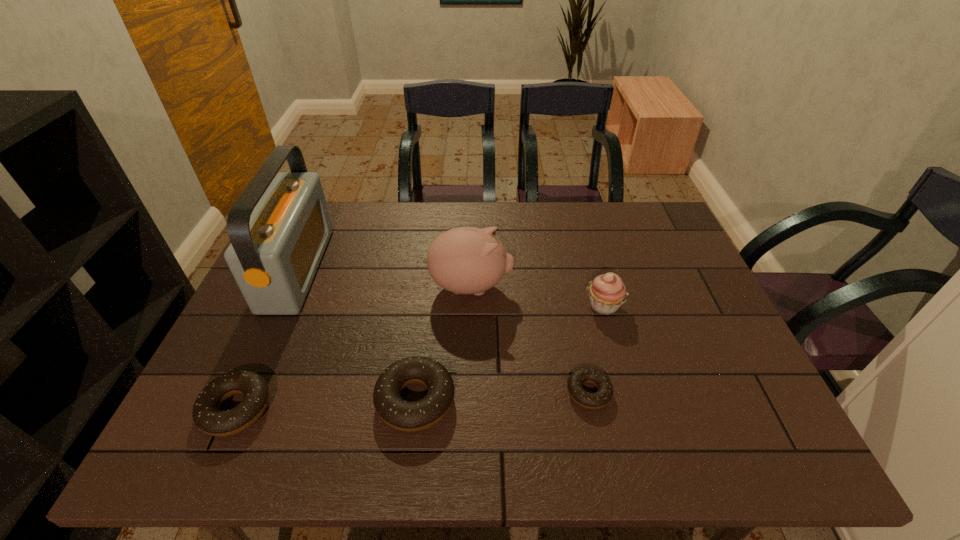
Identify the location of the leftmost doughnut. (207, 415).

Identify the location of the second tallest doughnut. The height and width of the screenshot is (540, 960). (207, 415).

Locate an element on the screen. the second doughnut from left to right is located at coordinates (399, 414).

Where is `the shortest object`? The height and width of the screenshot is (540, 960). the shortest object is located at coordinates (599, 399).

Locate an element on the screen. The height and width of the screenshot is (540, 960). the rightmost doughnut is located at coordinates click(599, 399).

You are a GUI agent. You are given a task and a screenshot of the screen. Output one action in this format:
    pyautogui.click(x=<x>, y=<y>)
    Task: Click on the tallest object
    
    Given the screenshot: What is the action you would take?
    pyautogui.click(x=279, y=227)

Locate an element on the screen. The image size is (960, 540). piggy bank is located at coordinates (466, 260).

Find the location of a particular element. This screenshot has width=960, height=540. cupcake is located at coordinates (607, 292).

I want to click on free space located on the back of the second shortest doughnut, so click(300, 267).

Find the location of a particular element. This screenshot has height=540, width=960. vacant space located on the right of the second doughnut from left to right is located at coordinates pyautogui.click(x=545, y=400).